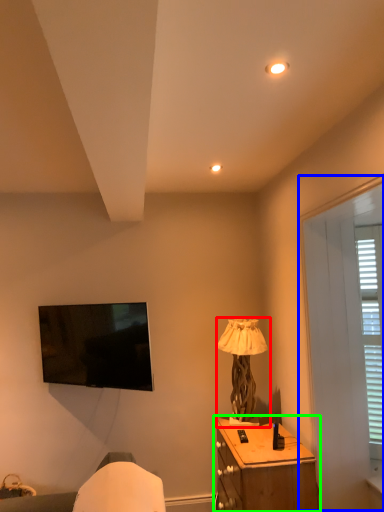
Question: Which object is positioned farthest from lamp (highlighted by a red box)? Select from screen door (highlighted by a blue box) and nightstand (highlighted by a green box).

Choices:
 (A) screen door
 (B) nightstand

Answer: (A)